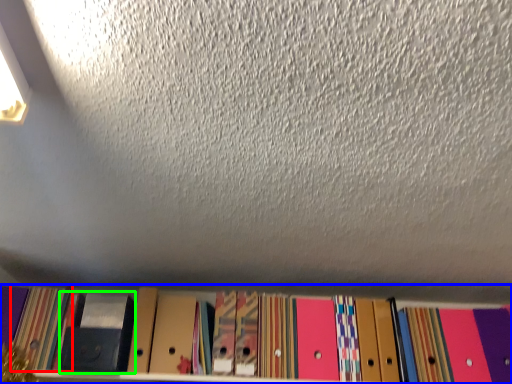
Question: Estimate the real-world distances between objects in this image. Which object is closer to paperback book (highlighted by a red box), shelf (highlighted by a blue box) or paperback book (highlighted by a green box)?

Choices:
 (A) shelf
 (B) paperback book

Answer: (B)